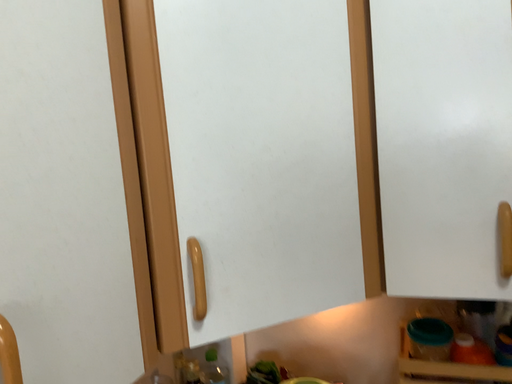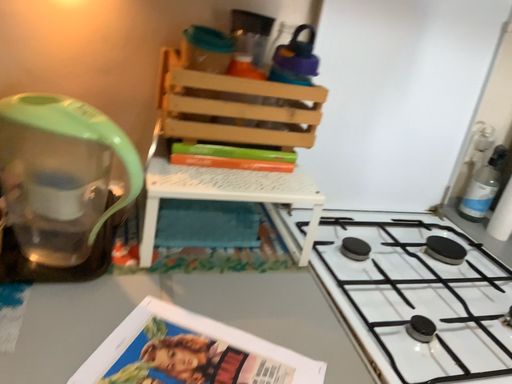
Question: Which way did the camera rotate in the video?

Choices:
 (A) rotated upward
 (B) rotated downward

Answer: (B)